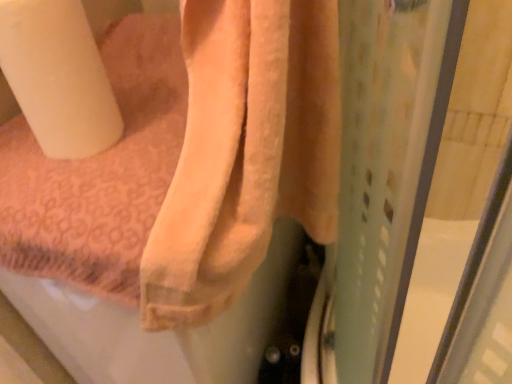
Locate an element on the screen. Image resolution: width=512 pixels, height=384 pixels. orange terry towel at upper center is located at coordinates (245, 151).

Describe the element at coordinates (245, 151) in the screenshot. I see `orange terry towel at upper center` at that location.

Measure the distance between white matte toilet paper at left and camera.

They are 18.85 inches apart.

Image resolution: width=512 pixels, height=384 pixels. I want to click on white matte toilet paper at left, so click(x=58, y=77).

Describe the element at coordinates (58, 77) in the screenshot. I see `white matte toilet paper at left` at that location.

Where is `orange terry towel at upper center`? orange terry towel at upper center is located at coordinates (245, 151).

Looking at this image, considering the relative positions of white matte toilet paper at left and orange terry towel at upper center in the image provided, is white matte toilet paper at left to the left or to the right of orange terry towel at upper center?

From the image, it's evident that white matte toilet paper at left is to the left of orange terry towel at upper center.

Is white matte toilet paper at left closer to camera compared to orange terry towel at upper center?

No.

Does point (33, 26) appear closer or farther from the camera than point (300, 54)?

Clearly, point (33, 26) is closer to the camera than point (300, 54).

From the picture: From the image's perspective, is white matte toilet paper at left located beneath orange terry towel at upper center?

Incorrect, from the image's perspective, white matte toilet paper at left is higher than orange terry towel at upper center.

From a real-world perspective, between white matte toilet paper at left and orange terry towel at upper center, who is vertically lower?

orange terry towel at upper center is physically lower.

Considering the sizes of objects white matte toilet paper at left and orange terry towel at upper center in the image provided, who is thinner, white matte toilet paper at left or orange terry towel at upper center?

Thinner between the two is white matte toilet paper at left.

Is white matte toilet paper at left taller or shorter than orange terry towel at upper center?

In the image, white matte toilet paper at left appears to be shorter than orange terry towel at upper center.

Based on the photo, based on their sizes in the image, would you say white matte toilet paper at left is bigger or smaller than orange terry towel at upper center?

In the image, white matte toilet paper at left appears to be smaller than orange terry towel at upper center.

Which is correct: white matte toilet paper at left is inside orange terry towel at upper center, or outside of it?

white matte toilet paper at left is not inside orange terry towel at upper center, it's outside.

Is white matte toilet paper at left not close to orange terry towel at upper center?

white matte toilet paper at left is near orange terry towel at upper center, not far away.

Consider the image. Is white matte toilet paper at left oriented towards orange terry towel at upper center?

No, white matte toilet paper at left is not oriented towards orange terry towel at upper center.

How far apart are white matte toilet paper at left and orange terry towel at upper center?

white matte toilet paper at left and orange terry towel at upper center are 9.09 inches apart from each other.

Locate an element on the screen. The image size is (512, 384). towel below the white matte toilet paper at left (from a real-world perspective) is located at coordinates (245, 151).

Which is more to the left, orange terry towel at upper center or white matte toilet paper at left?

white matte toilet paper at left is more to the left.

Who is more distant, orange terry towel at upper center or white matte toilet paper at left?

white matte toilet paper at left is behind.

Which is in front, point (209, 85) or point (75, 65)?

Point (209, 85)

From the image's perspective, which one is positioned lower, orange terry towel at upper center or white matte toilet paper at left?

From the image's view, orange terry towel at upper center is below.

From a real-world perspective, is orange terry towel at upper center physically above white matte toilet paper at left?

No.

Is orange terry towel at upper center wider or thinner than white matte toilet paper at left?

Considering their sizes, orange terry towel at upper center looks broader than white matte toilet paper at left.

Consider the image. Considering the relative sizes of orange terry towel at upper center and white matte toilet paper at left in the image provided, is orange terry towel at upper center taller than white matte toilet paper at left?

Yes, orange terry towel at upper center is taller than white matte toilet paper at left.

Is orange terry towel at upper center bigger than white matte toilet paper at left?

Yes.

Is white matte toilet paper at left a part of orange terry towel at upper center?

No, white matte toilet paper at left is not surrounded by orange terry towel at upper center.

Are orange terry towel at upper center and white matte toilet paper at left beside each other?

No, orange terry towel at upper center is not with white matte toilet paper at left.

Consider the image. Is orange terry towel at upper center facing towards white matte toilet paper at left?

No, orange terry towel at upper center is not facing towards white matte toilet paper at left.

I want to click on toilet paper on the left of orange terry towel at upper center, so click(x=58, y=77).

Locate an element on the screen. The width and height of the screenshot is (512, 384). towel in front of the white matte toilet paper at left is located at coordinates (245, 151).

This screenshot has height=384, width=512. Find the location of `towel below the white matte toilet paper at left (from a real-world perspective)`. towel below the white matte toilet paper at left (from a real-world perspective) is located at coordinates (245, 151).